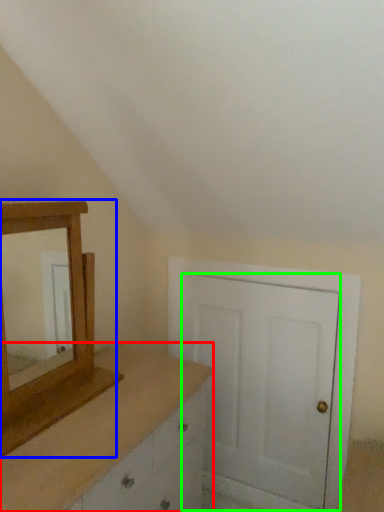
Question: Estimate the real-world distances between objects in this image. Which object is farther from chest of drawers (highlighted by a red box), medicine cabinet (highlighted by a blue box) or door (highlighted by a green box)?

Choices:
 (A) medicine cabinet
 (B) door

Answer: (B)